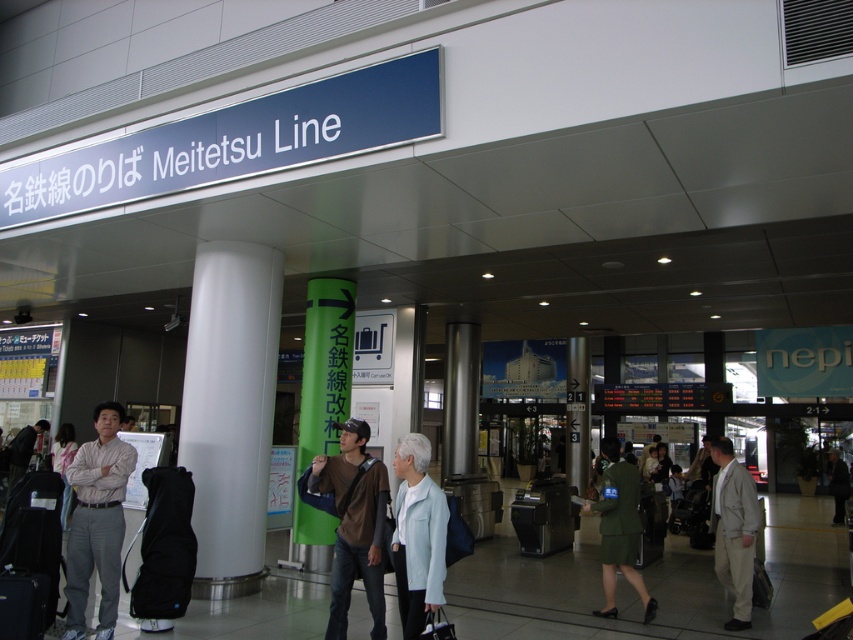
You are standing at the entrance of the Meitetsu Line station and notice a brown cotton shirt at center and a green matte pillar at center. Which object is positioned higher from the ground?

The brown cotton shirt at center is located above the green matte pillar at center, so it is positioned higher from the ground.

You are a security guard at the Meitetsu Line station entrance. You notice two people in the scene described. One is wearing a light beige suit at right and the other is in a green uniform at center. Which individual should you approach first based on their size?

The light beige suit at right is larger in size than the green uniform at center, so you should approach the light beige suit at right first since they are bigger and might need assistance.